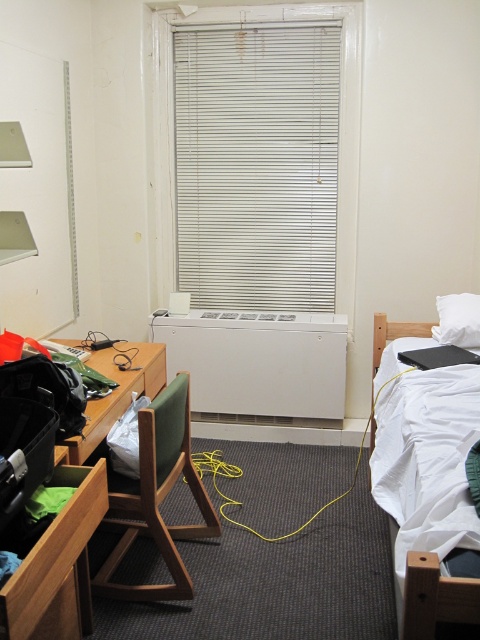
You are organizing the room and need to move the wooden desk at left and the white soft pillow at upper right. According to their positions, which object is located more to the left?

The wooden desk at left is positioned on the left side of the white soft pillow at upper right, so the wooden desk at left is more to the left.

You are a student who wants to hang a picture frame on the wall between the white matte radiator at center and the white soft bed at right. Since the radiator is taller than the bed, where should you place the frame to ensure it doesn

The white matte radiator at center is taller than the white soft bed at right. To hang the picture frame between them, position it at the same height as the radiator to maintain visual balance.

You are a student in the dorm room and need to adjust the lighting. The white matte blinds at center and wooden drawer at center are both in your way. Which object do you need to move first to reach the light switch?

The wooden drawer at center is shorter than the white matte blinds at center, so you should move the wooden drawer at center first to access the light switch.